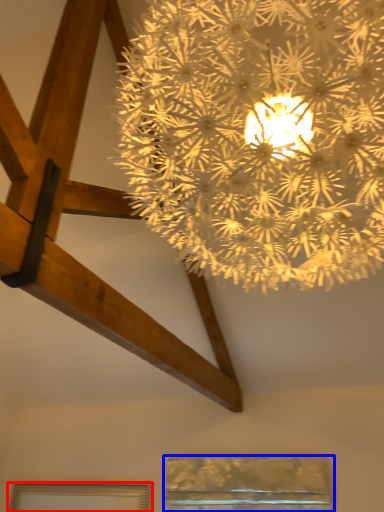
Question: Which point is further to the camera, window (highlighted by a red box) or window (highlighted by a blue box)?

Choices:
 (A) window
 (B) window

Answer: (A)